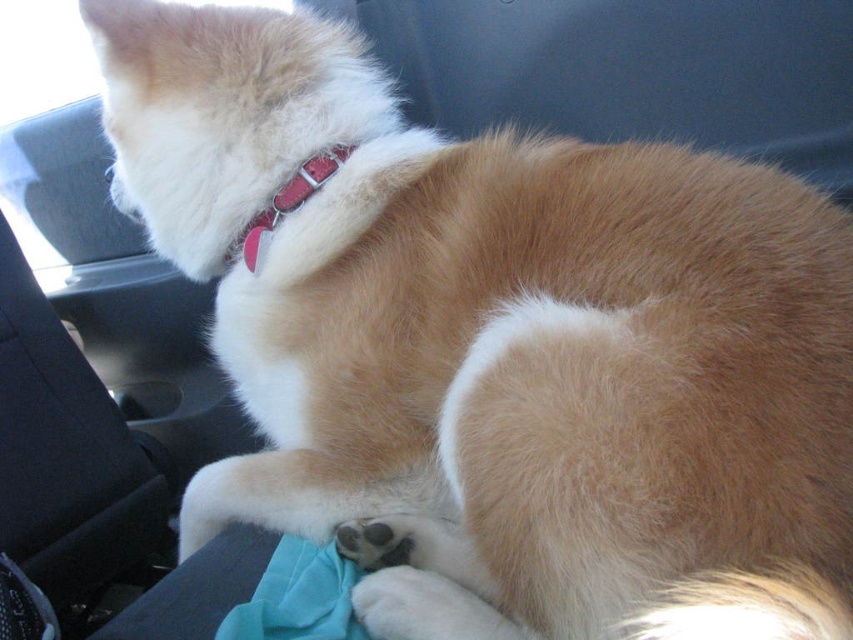
Which is below, teal fabric at lower center or red leather collar at upper center?

teal fabric at lower center

Does teal fabric at lower center have a lesser height compared to red leather collar at upper center?

Yes.

Who is more forward, (338, 596) or (254, 248)?

Point (338, 596) is in front.

The image size is (853, 640). What are the coordinates of `teal fabric at lower center` in the screenshot? It's located at (299, 596).

Between matte red collar at upper center and teal fabric at lower center, which one has more height?

Standing taller between the two is matte red collar at upper center.

Is point (599, 26) closer to camera compared to point (294, 611)?

No, (599, 26) is behind (294, 611).

Locate an element on the screen. The image size is (853, 640). matte red collar at upper center is located at coordinates (x=630, y=70).

Does matte red collar at upper center appear under red leather collar at upper center?

No, matte red collar at upper center is not below red leather collar at upper center.

Who is positioned more to the left, matte red collar at upper center or red leather collar at upper center?

Positioned to the left is red leather collar at upper center.

Who is more forward, (567, 67) or (242, 232)?

Point (242, 232) is in front.

In order to click on matte red collar at upper center in this screenshot , I will do `click(630, 70)`.